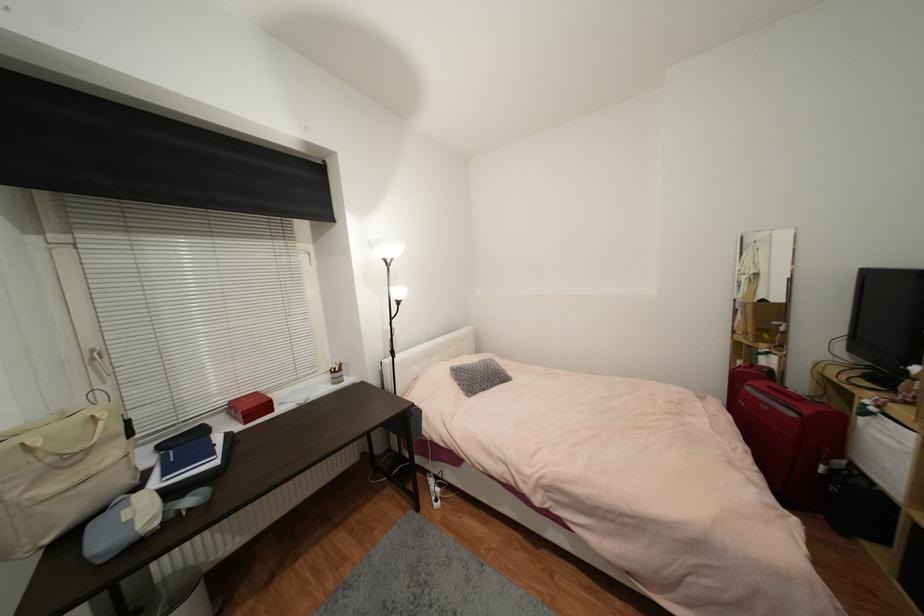
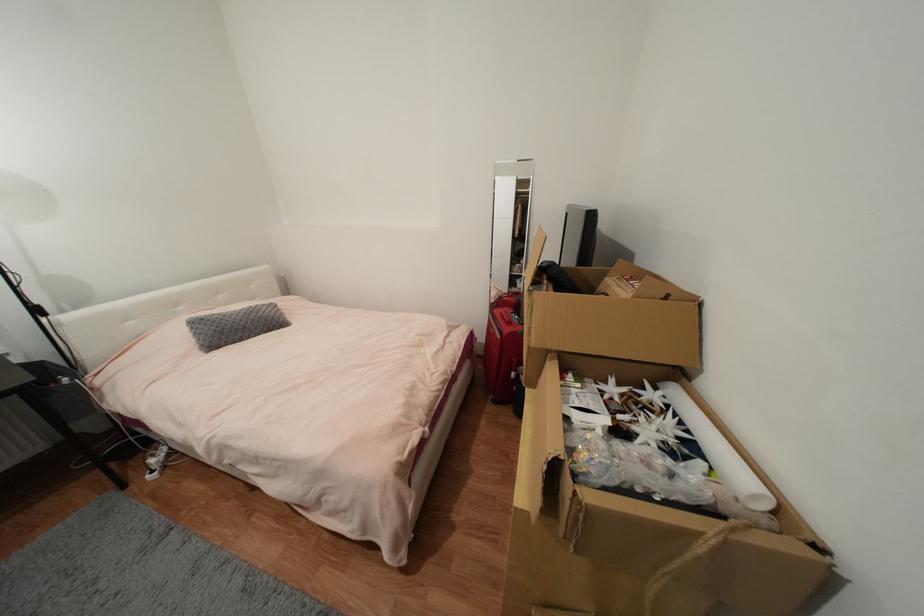
The point at (x=827, y=469) is marked in the first image. Where is the corresponding point in the second image?

(517, 375)